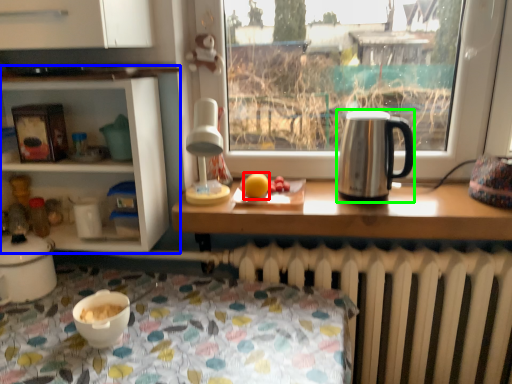
Question: Based on their relative distances, which object is nearer to orange (highlighted by a red box)? Choose from shelf (highlighted by a blue box) and kettle (highlighted by a green box).

Choices:
 (A) shelf
 (B) kettle

Answer: (B)